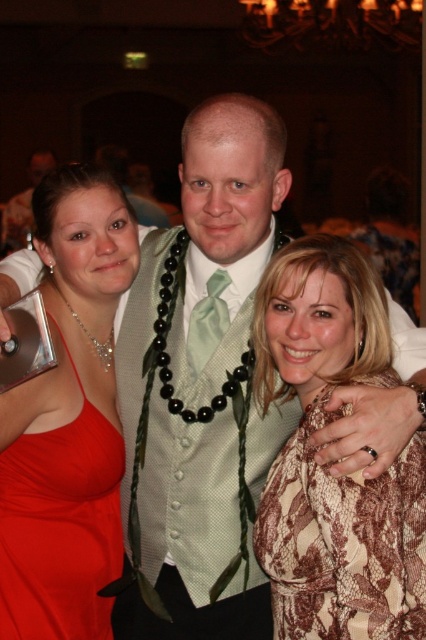
Based on the photo, you are standing in front of the group photo and want to determine the spatial relationship between the two points marked in the image. Which point is closer to you, point (13,632) or point (184,305)?

Point (13,632) is in front of point (184,305), so it is closer to you.